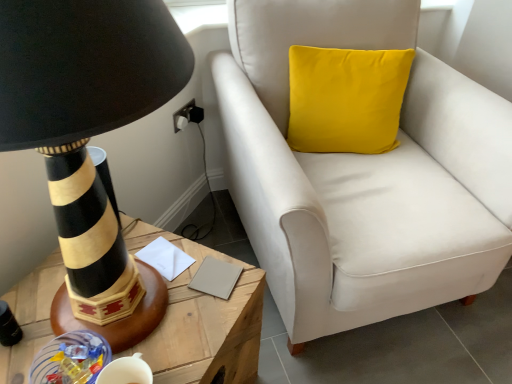
Find the location of a particular element. This screenshot has width=512, height=384. vacant space in front of white paper at center, the first notepad viewed from the left is located at coordinates (178, 319).